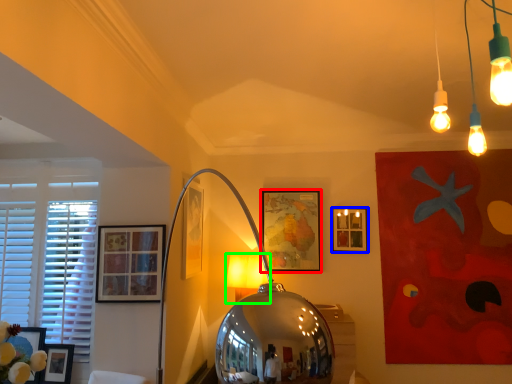
Question: Based on their relative distances, which object is nearer to picture frame (highlighted by a red box)? Choose from picture frame (highlighted by a blue box) and table lamp (highlighted by a green box).

Choices:
 (A) picture frame
 (B) table lamp

Answer: (A)